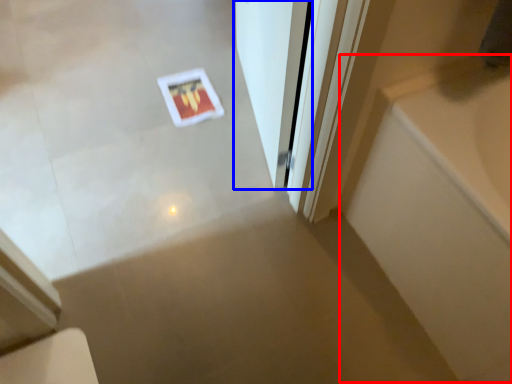
Question: Which object appears farthest to the camera in this image, bath (highlighted by a red box) or door (highlighted by a blue box)?

Choices:
 (A) bath
 (B) door

Answer: (B)